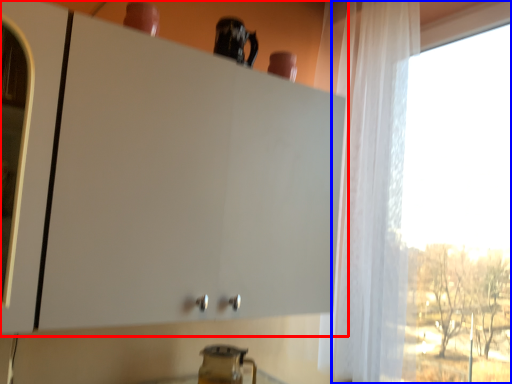
Question: Which of the following is the farthest to the observer, cabinetry (highlighted by a red box) or window (highlighted by a blue box)?

Choices:
 (A) cabinetry
 (B) window

Answer: (B)